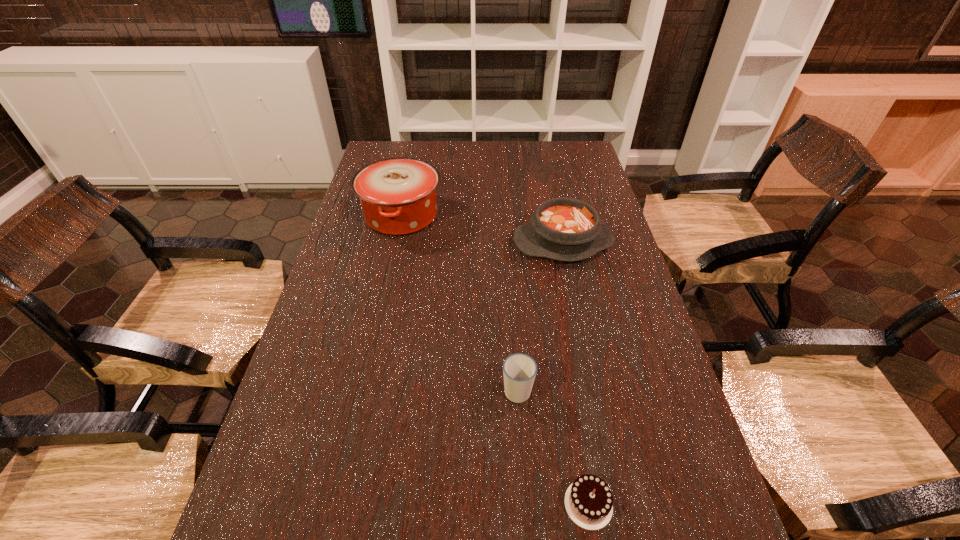
What are the coordinates of `free space located 0.360m with a handle on the side of the cup` in the screenshot? It's located at (509, 271).

You are a GUI agent. You are given a task and a screenshot of the screen. Output one action in this format:
    pyautogui.click(x=<x>, y=<y>)
    Task: Click on the vacant space located on the left of the nearest object
    This screenshot has height=540, width=960.
    Given the screenshot: What is the action you would take?
    pyautogui.click(x=534, y=504)

Find the location of a particular element. The height and width of the screenshot is (540, 960). object located at the left edge is located at coordinates (398, 195).

This screenshot has height=540, width=960. What are the coordinates of `object at the right edge` in the screenshot? It's located at (565, 229).

In order to click on blank space at the far edge of the desktop in this screenshot , I will do `click(451, 145)`.

Locate an element on the screen. The height and width of the screenshot is (540, 960). vacant area at the left edge of the desktop is located at coordinates (375, 246).

Locate an element on the screen. The height and width of the screenshot is (540, 960). vacant space at the right edge is located at coordinates (613, 361).

Locate an element on the screen. vacant point at the far right corner is located at coordinates (559, 146).

Find the location of a particular element. The image size is (960, 540). unoccupied area between the shortest object and the right casserole is located at coordinates (576, 373).

The height and width of the screenshot is (540, 960). Identify the location of free point between the shorter casserole and the nearest object. (576, 373).